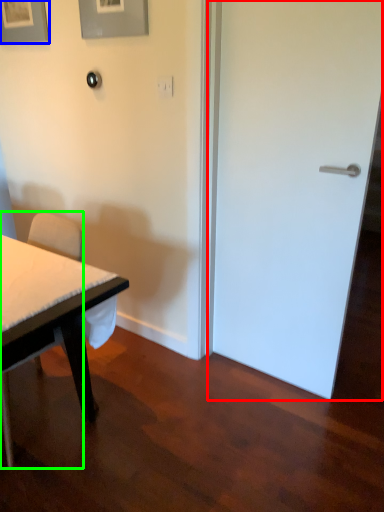
Question: Considering the real-world distances, which object is farthest from door (highlighted by a red box)? picture frame (highlighted by a blue box) or chair (highlighted by a green box)?

Choices:
 (A) picture frame
 (B) chair

Answer: (A)